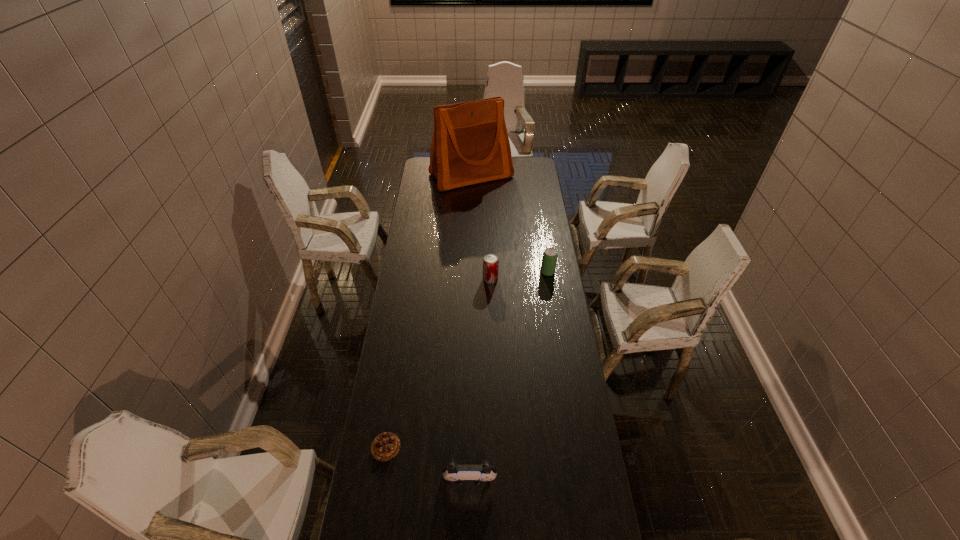
The width and height of the screenshot is (960, 540). In order to click on shopping bag in this screenshot , I will do coord(470,145).

Find the location of a particular element. the farthest object is located at coordinates (470, 145).

Locate an element on the screen. The height and width of the screenshot is (540, 960). the right soda can is located at coordinates [x=549, y=259].

Find the location of a particular element. The image size is (960, 540). the left soda can is located at coordinates (490, 262).

Where is `the nearest object`? the nearest object is located at coordinates (478, 474).

Identify the location of the second nearest object. (385, 446).

Identify the location of chocolate cake. Image resolution: width=960 pixels, height=540 pixels. (385, 446).

The width and height of the screenshot is (960, 540). Identify the location of vacant point located 0.230m on the front of the farthest object. (470, 218).

The height and width of the screenshot is (540, 960). In order to click on free space located 0.310m on the left of the rightmost object in this screenshot , I will do `click(475, 272)`.

Identify the location of free space located 0.050m on the back of the left soda can. (491, 266).